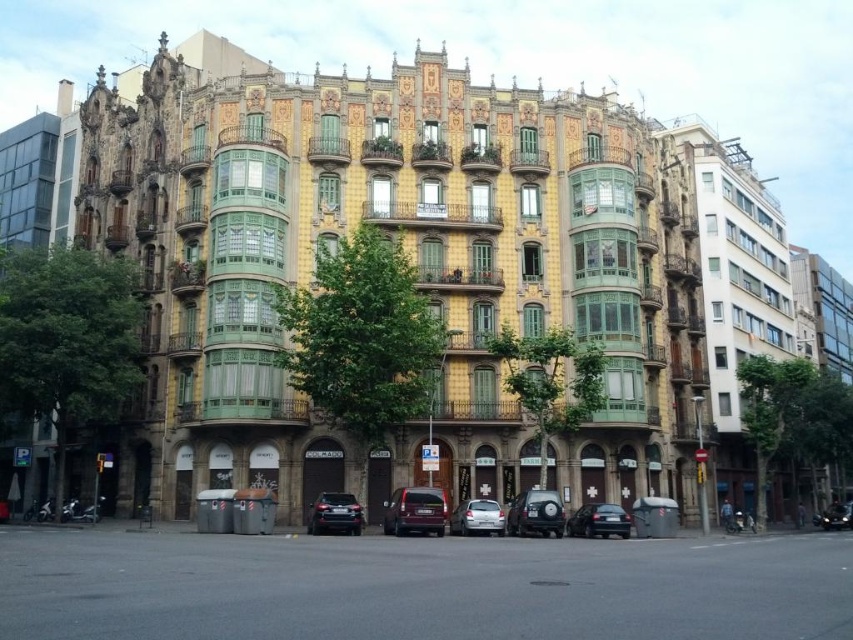
Does satin burgundy suv at center have a greater width compared to shiny black suv at center?

Indeed, satin burgundy suv at center has a greater width compared to shiny black suv at center.

This screenshot has height=640, width=853. Identify the location of satin burgundy suv at center. (415, 512).

Who is positioned more to the right, silver metallic car at center or shiny black car at lower right?

Positioned to the right is shiny black car at lower right.

Locate an element on the screen. The width and height of the screenshot is (853, 640). silver metallic car at center is located at coordinates (477, 516).

Does satin burgundy suv at center have a smaller size compared to satin black car at center?

No.

The image size is (853, 640). In order to click on satin burgundy suv at center in this screenshot , I will do `click(415, 512)`.

Where is `satin burgundy suv at center`? satin burgundy suv at center is located at coordinates (415, 512).